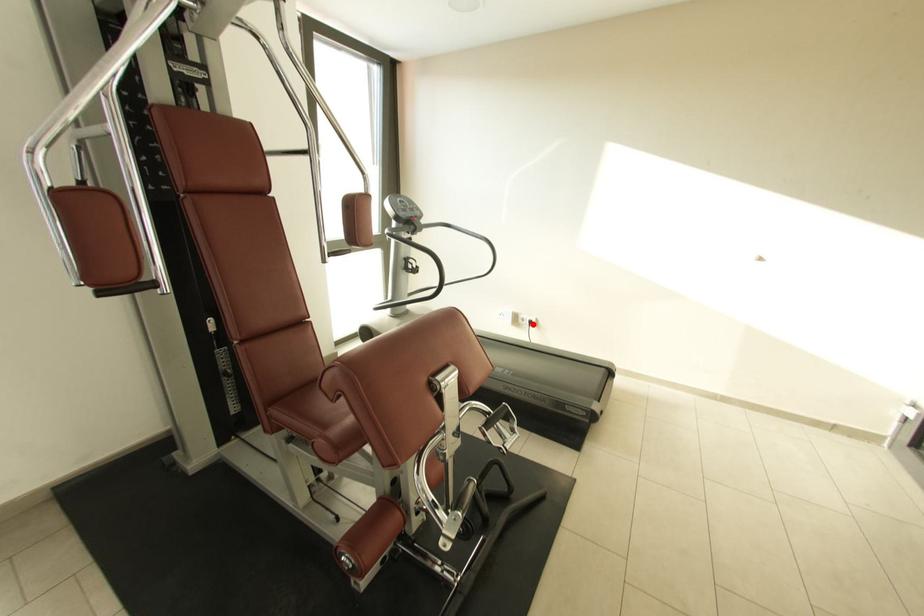
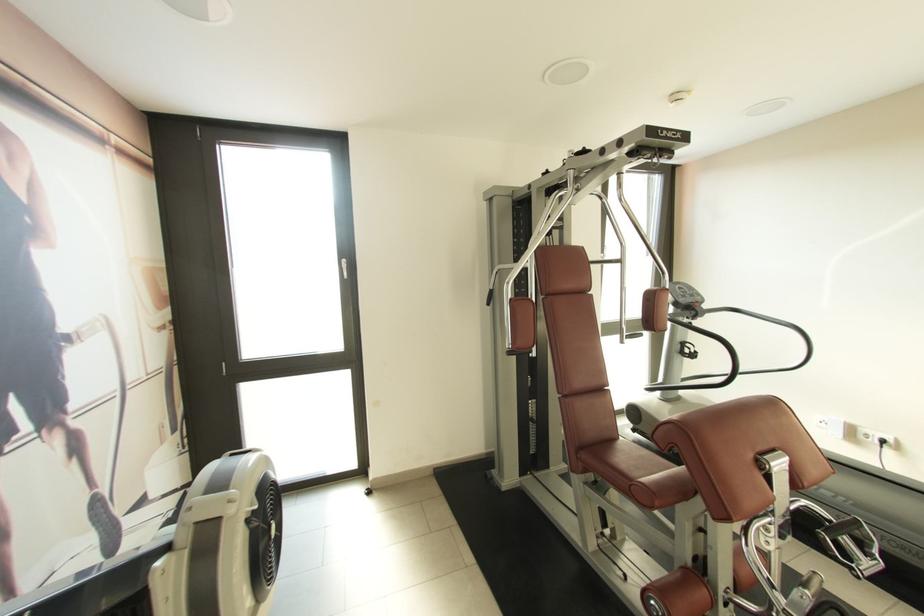
Question: A red point is marked in image1. In image2, is the corresponding 3D point closer to the camera or farther? Reply with the corresponding letter.

Choices:
 (A) The corresponding 3D point is closer.
 (B) The corresponding 3D point is farther.

Answer: (A)